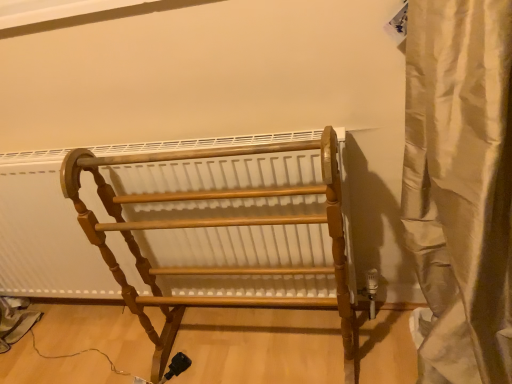
Describe the element at coordinates (226, 231) in the screenshot. This screenshot has height=384, width=512. I see `wooden towel rack at center` at that location.

Measure the distance between point (296,191) and camera.

The distance of point (296,191) from camera is 1.08 meters.

Where is `wooden towel rack at center`? wooden towel rack at center is located at coordinates [226, 231].

Locate an element on the screen. beige satin curtain at right is located at coordinates (461, 185).

This screenshot has height=384, width=512. Describe the element at coordinates (461, 185) in the screenshot. I see `beige satin curtain at right` at that location.

The width and height of the screenshot is (512, 384). In order to click on wooden towel rack at center in this screenshot , I will do `click(226, 231)`.

Between wooden towel rack at center and beige satin curtain at right, which one appears on the right side from the viewer's perspective?

beige satin curtain at right is more to the right.

Considering their positions, is wooden towel rack at center located in front of or behind beige satin curtain at right?

wooden towel rack at center is behind beige satin curtain at right.

Which is behind, point (281, 279) or point (496, 146)?

Positioned behind is point (281, 279).

From the image's perspective, which one is positioned lower, wooden towel rack at center or beige satin curtain at right?

wooden towel rack at center is shown below in the image.

From a real-world perspective, which is physically above, wooden towel rack at center or beige satin curtain at right?

beige satin curtain at right.

Considering the sizes of objects wooden towel rack at center and beige satin curtain at right in the image provided, who is wider, wooden towel rack at center or beige satin curtain at right?

beige satin curtain at right.

Who is shorter, wooden towel rack at center or beige satin curtain at right?

Standing shorter between the two is wooden towel rack at center.

Considering the sizes of objects wooden towel rack at center and beige satin curtain at right in the image provided, who is smaller, wooden towel rack at center or beige satin curtain at right?

With smaller size is beige satin curtain at right.

Can we say wooden towel rack at center lies outside beige satin curtain at right?

Yes, wooden towel rack at center is not within beige satin curtain at right.

Is wooden towel rack at center with beige satin curtain at right?

No, wooden towel rack at center is not in contact with beige satin curtain at right.

Is wooden towel rack at center facing towards beige satin curtain at right?

No, wooden towel rack at center does not turn towards beige satin curtain at right.

How many degrees apart are the facing directions of wooden towel rack at center and beige satin curtain at right?

There is a 1.27-degree angle between the facing directions of wooden towel rack at center and beige satin curtain at right.

In order to click on furniture below the beige satin curtain at right (from a real-world perspective) in this screenshot , I will do coord(226,231).

Considering the positions of objects beige satin curtain at right and wooden towel rack at center in the image provided, who is more to the right, beige satin curtain at right or wooden towel rack at center?

beige satin curtain at right.

Which object is further away from the camera, beige satin curtain at right or wooden towel rack at center?

wooden towel rack at center is further away from the camera.

Does point (449, 359) appear closer or farther from the camera than point (223, 256)?

Point (449, 359).

From the image's perspective, who appears lower, beige satin curtain at right or wooden towel rack at center?

wooden towel rack at center is shown below in the image.

From a real-world perspective, which object rests below the other?

In real-world perspective, wooden towel rack at center is lower.

Considering the relative sizes of beige satin curtain at right and wooden towel rack at center in the image provided, is beige satin curtain at right wider than wooden towel rack at center?

Yes, beige satin curtain at right is wider than wooden towel rack at center.

From the picture: Between beige satin curtain at right and wooden towel rack at center, which one has less height?

Standing shorter between the two is wooden towel rack at center.

Does beige satin curtain at right have a smaller size compared to wooden towel rack at center?

Yes.

Is beige satin curtain at right inside the boundaries of wooden towel rack at center, or outside?

The correct answer is: outside.

Is beige satin curtain at right next to wooden towel rack at center?

No, beige satin curtain at right is not in contact with wooden towel rack at center.

Could you tell me if beige satin curtain at right is turned towards wooden towel rack at center?

No, beige satin curtain at right is not oriented towards wooden towel rack at center.

How different are the orientations of beige satin curtain at right and wooden towel rack at center in degrees?

The facing directions of beige satin curtain at right and wooden towel rack at center are 1.27 degrees apart.

Find the location of a particular element. furniture located below the beige satin curtain at right (from the image's perspective) is located at coordinates (226, 231).

Find the location of a particular element. The image size is (512, 384). curtain in front of the wooden towel rack at center is located at coordinates (461, 185).

This screenshot has height=384, width=512. Find the location of `furniture below the beige satin curtain at right (from a real-world perspective)`. furniture below the beige satin curtain at right (from a real-world perspective) is located at coordinates (226, 231).